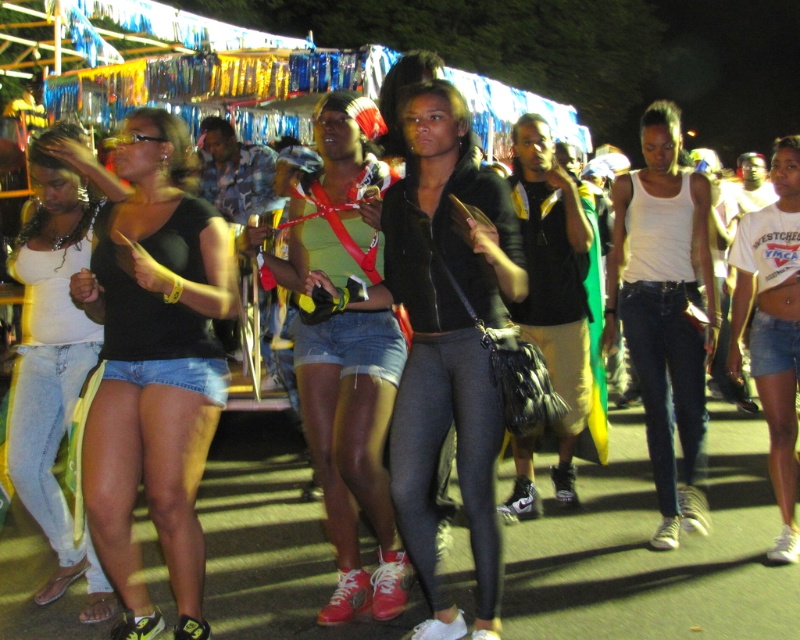
Who is lower down, matte black tank top at left or matte black jacket at center?

matte black tank top at left is lower down.

Does matte black tank top at left appear on the left side of matte black jacket at center?

Correct, you'll find matte black tank top at left to the left of matte black jacket at center.

Locate an element on the screen. matte black tank top at left is located at coordinates (154, 365).

Is white matte tank top at center thinner than light blue denim shorts at left?

Indeed, white matte tank top at center has a lesser width compared to light blue denim shorts at left.

Who is more distant from viewer, [656,186] or [66,259]?

The point [656,186] is behind.

Is point (614, 200) positioned behind point (20, 435)?

Yes, point (614, 200) is farther from viewer.

Locate an element on the screen. This screenshot has width=800, height=640. white matte tank top at center is located at coordinates (664, 310).

Is matte black tank top at left shorter than denim shorts at center?

Correct, matte black tank top at left is not as tall as denim shorts at center.

Does point (138, 257) lie in front of point (356, 595)?

Yes, it is in front of point (356, 595).

Locate an element on the screen. The height and width of the screenshot is (640, 800). matte black tank top at left is located at coordinates (154, 365).